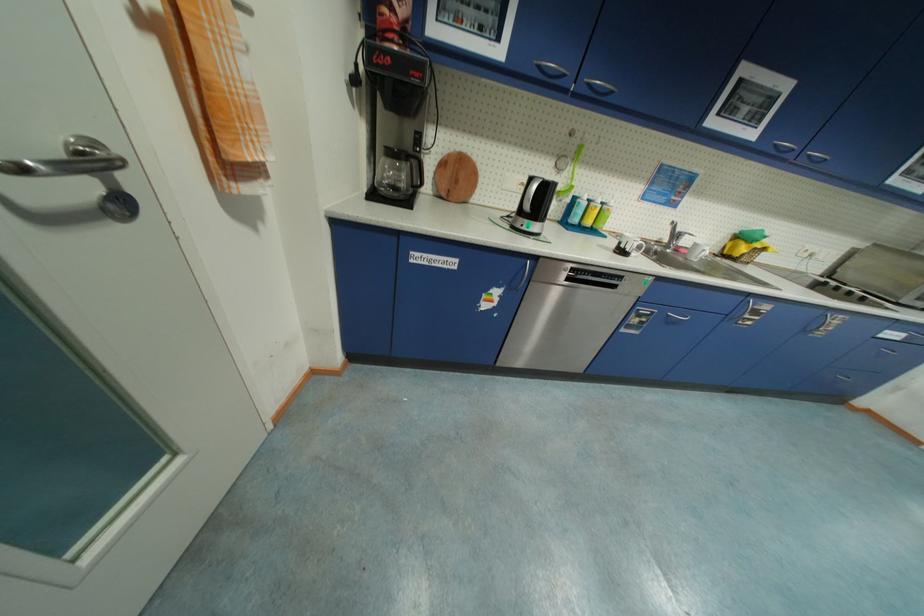
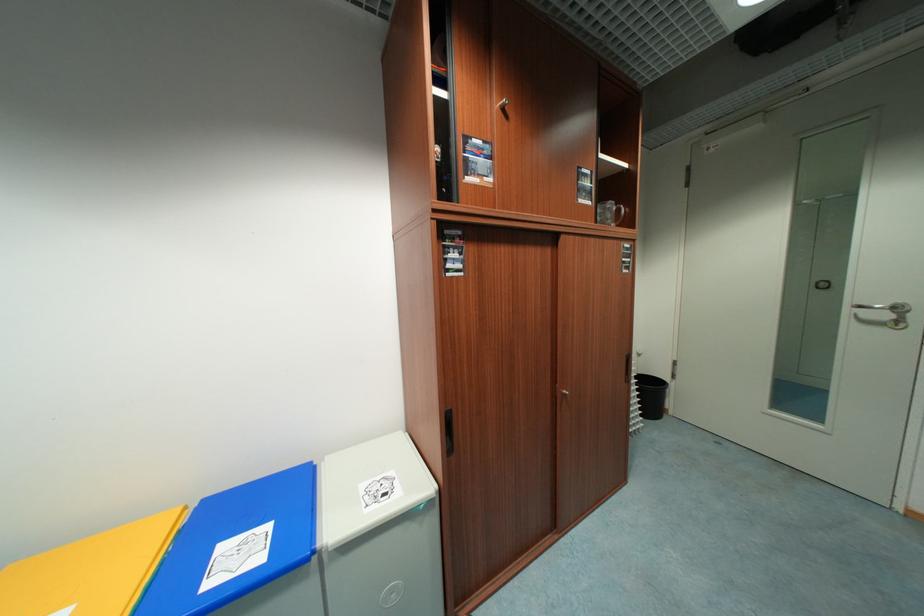
Question: I am providing you with two images of the same scene from different viewpoints. Which of the following objects are not visible in image2?

Choices:
 (A) silver door handle
 (B) yellow bin lid
 (C) blue bin lid
 (D) clear plastic tray

Answer: (A)